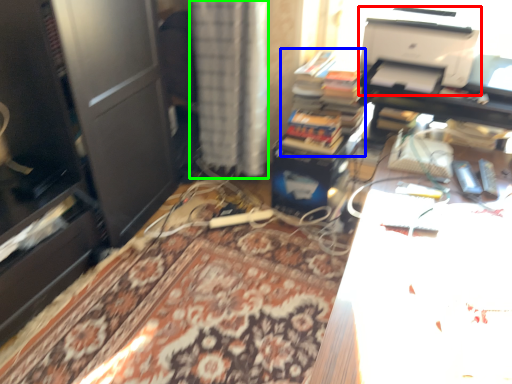
Question: Based on their relative distances, which object is nearer to printer (highlighted by a red box)? Choose from book (highlighted by a blue box) and curtain (highlighted by a green box).

Choices:
 (A) book
 (B) curtain

Answer: (A)